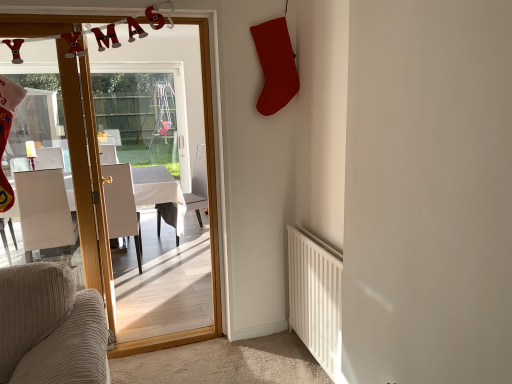
Question: From a real-world perspective, is white matte radiator at lower right on top of white leather chair at left, which ranks as the 3th chair in right-to-left order?

Choices:
 (A) no
 (B) yes

Answer: (A)

Question: Considering the relative sizes of white matte radiator at lower right and white leather chair at left, the 1th chair when ordered from left to right, in the image provided, is white matte radiator at lower right wider than white leather chair at left, the 1th chair when ordered from left to right,?

Choices:
 (A) no
 (B) yes

Answer: (A)

Question: From the image's perspective, is white matte radiator at lower right located beneath white leather chair at left, which ranks as the 3th chair in right-to-left order?

Choices:
 (A) yes
 (B) no

Answer: (A)

Question: Is white matte radiator at lower right in front of white leather chair at left, which ranks as the 3th chair in right-to-left order?

Choices:
 (A) no
 (B) yes

Answer: (B)

Question: Considering the relative sizes of white matte radiator at lower right and white leather chair at left, which ranks as the 3th chair in right-to-left order, in the image provided, is white matte radiator at lower right taller than white leather chair at left, which ranks as the 3th chair in right-to-left order,?

Choices:
 (A) yes
 (B) no

Answer: (B)

Question: From a real-world perspective, is white leather chair at center, which is the first chair from right to left, above or below white leather chair at left, acting as the second chair starting from the left?

Choices:
 (A) above
 (B) below

Answer: (B)

Question: In the image, is white leather chair at center, the 3th chair viewed from the left, on the left side or the right side of white leather chair at left, which appears as the 2th chair when viewed from the right?

Choices:
 (A) left
 (B) right

Answer: (B)

Question: From the image's perspective, relative to white leather chair at left, which appears as the 2th chair when viewed from the right, is white leather chair at center, the 3th chair viewed from the left, above or below?

Choices:
 (A) above
 (B) below

Answer: (A)

Question: In the image, is white leather chair at center, the 3th chair viewed from the left, positioned in front of or behind white leather chair at left, which appears as the 2th chair when viewed from the right?

Choices:
 (A) behind
 (B) front

Answer: (A)

Question: Is wooden glass door at center to the left or to the right of white glossy table at center in the image?

Choices:
 (A) right
 (B) left

Answer: (A)

Question: Based on their sizes in the image, would you say wooden glass door at center is bigger or smaller than white glossy table at center?

Choices:
 (A) small
 (B) big

Answer: (A)

Question: Considering their positions, is wooden glass door at center located in front of or behind white glossy table at center?

Choices:
 (A) behind
 (B) front

Answer: (B)

Question: Is wooden glass door at center wider or thinner than white glossy table at center?

Choices:
 (A) wide
 (B) thin

Answer: (B)

Question: In terms of width, does white leather chair at left, acting as the second chair starting from the left, look wider or thinner when compared to white glossy table at center?

Choices:
 (A) wide
 (B) thin

Answer: (B)

Question: Looking at the image, does white leather chair at left, which appears as the 2th chair when viewed from the right, seem bigger or smaller compared to white glossy table at center?

Choices:
 (A) big
 (B) small

Answer: (B)